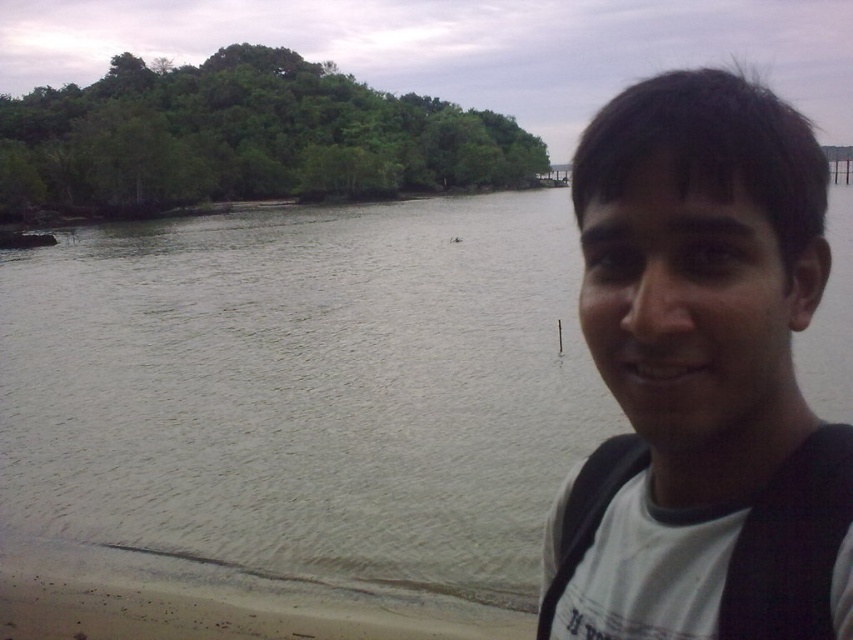
Question: Can you confirm if grayish-green water at center is positioned above white t-shirt at center?

Choices:
 (A) yes
 (B) no

Answer: (A)

Question: Which point is closer to the camera taking this photo?

Choices:
 (A) (770, 317)
 (B) (54, 483)

Answer: (A)

Question: Can you confirm if grayish-green water at center is positioned to the right of white t-shirt at center?

Choices:
 (A) no
 (B) yes

Answer: (B)

Question: Among these points, which one is farthest from the camera?

Choices:
 (A) (726, 289)
 (B) (187, 548)

Answer: (B)

Question: Which of the following is the closest to the observer?

Choices:
 (A) (688, 449)
 (B) (287, 442)

Answer: (A)

Question: Can you confirm if grayish-green water at center is wider than white t-shirt at center?

Choices:
 (A) no
 (B) yes

Answer: (B)